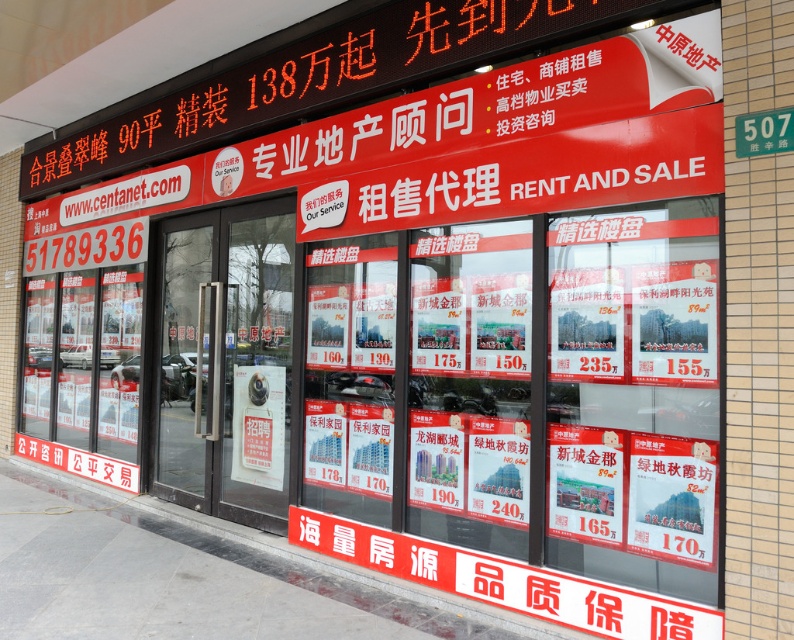
You are standing in front of the real estate agency storefront. There is a point labeled at coordinates (226, 358). What object is located at that point?

The point at coordinates (226, 358) corresponds to the transparent glass door at center.

You are a customer standing in front of the real estate agency storefront. You want to read the white paper posters at center and the green metallic street sign at upper right. Which object is taller?

The white paper posters at center is taller than the green metallic street sign at upper right.